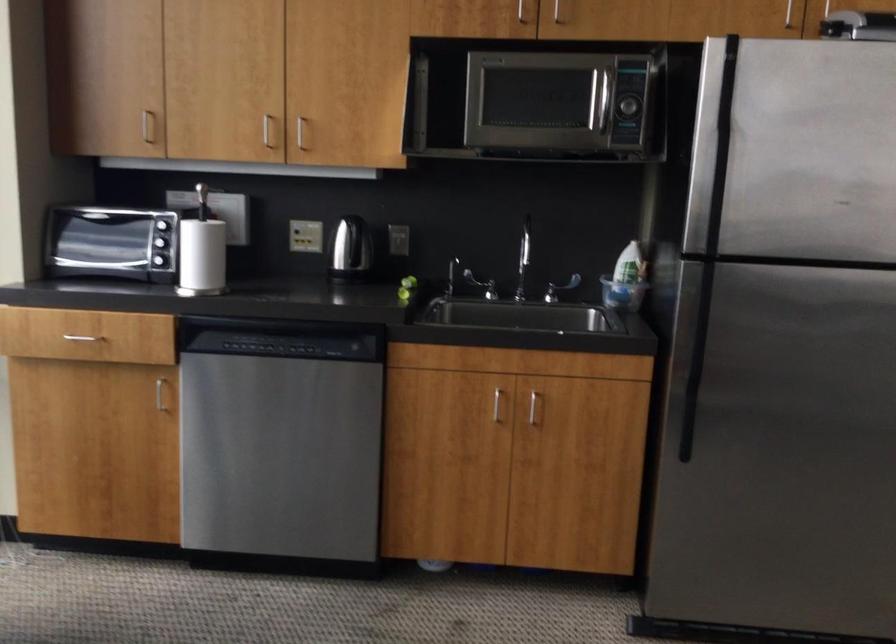
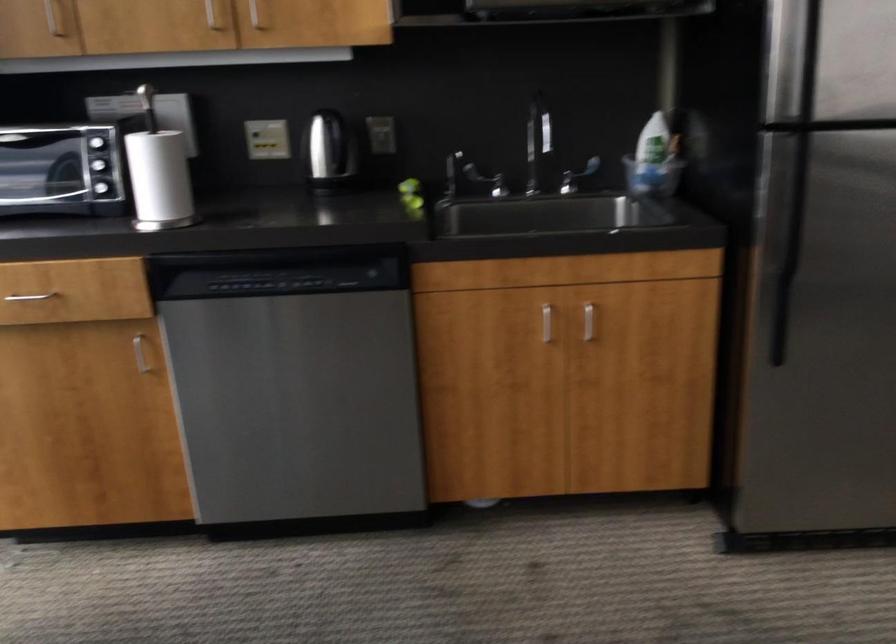
Where in the second image is the point corresponding to [500,406] from the first image?

(546, 323)